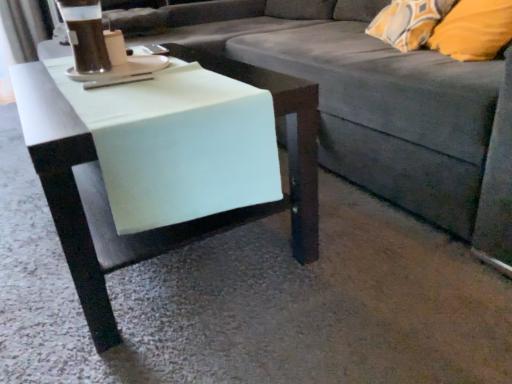
Question: Considering their positions, is gray fabric couch at center located in front of or behind dark brown liquid at upper left?

Choices:
 (A) front
 (B) behind

Answer: (A)

Question: Choose the correct answer: Is gray fabric couch at center inside dark brown liquid at upper left or outside it?

Choices:
 (A) outside
 (B) inside

Answer: (A)

Question: Which is farther from the gray fabric couch at center?

Choices:
 (A) dark brown liquid at upper left
 (B) white glossy saucer at upper left
 (C) white matte table at center

Answer: (A)

Question: Estimate the real-world distances between objects in this image. Which object is farther from the white glossy saucer at upper left?

Choices:
 (A) gray fabric couch at center
 (B) dark brown liquid at upper left
 (C) white matte table at center

Answer: (A)